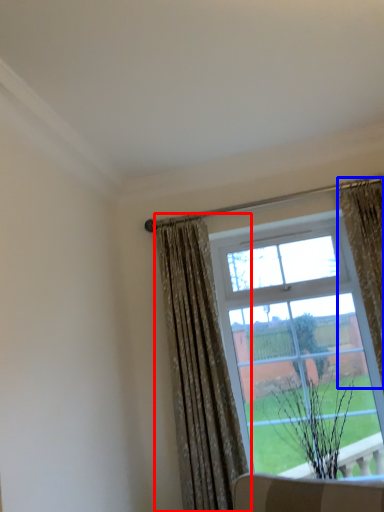
Question: Which object appears farthest to the camera in this image, curtain (highlighted by a red box) or curtain (highlighted by a blue box)?

Choices:
 (A) curtain
 (B) curtain

Answer: (A)